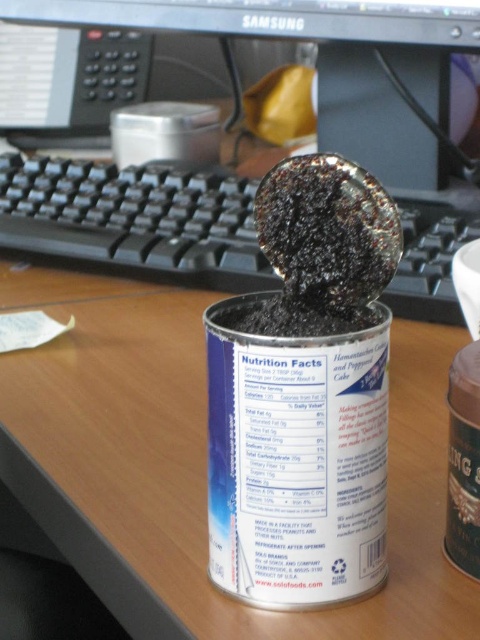
Which is in front, point (172, 545) or point (188, 225)?

Point (172, 545) is in front.

Is metallic silver can at center below black plastic keyboard at center?

Correct, metallic silver can at center is located below black plastic keyboard at center.

Is point (334, 620) in front of point (141, 236)?

Yes, it is.

The image size is (480, 640). Find the location of `metallic silver can at center`. metallic silver can at center is located at coordinates (200, 465).

Looking at this image, can you confirm if metallic silver can at center is shorter than matte black monitor at upper center?

In fact, metallic silver can at center may be taller than matte black monitor at upper center.

Is metallic silver can at center above matte black monitor at upper center?

Actually, metallic silver can at center is below matte black monitor at upper center.

Where is `metallic silver can at center`? metallic silver can at center is located at coordinates (200, 465).

Is black plastic keyboard at center below matte black monitor at upper center?

Indeed, black plastic keyboard at center is positioned under matte black monitor at upper center.

Can you confirm if black plastic keyboard at center is positioned to the right of matte black monitor at upper center?

Yes, black plastic keyboard at center is to the right of matte black monitor at upper center.

Is point (231, 248) farther from camera compared to point (34, 1)?

No, it is not.

The height and width of the screenshot is (640, 480). In order to click on black plastic keyboard at center in this screenshot , I will do `click(133, 220)`.